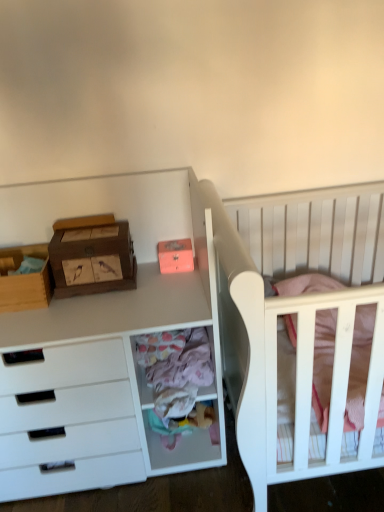
Question: Is wooden storage box at left, arranged as the 1th storage box when viewed from the left, not within white wood crib at right?

Choices:
 (A) yes
 (B) no

Answer: (A)

Question: Considering the relative positions of wooden storage box at left, acting as the 2th storage box starting from the right, and white wood crib at right in the image provided, is wooden storage box at left, acting as the 2th storage box starting from the right, behind white wood crib at right?

Choices:
 (A) no
 (B) yes

Answer: (B)

Question: Can white wood crib at right be found inside wooden storage box at left, arranged as the 1th storage box when viewed from the left?

Choices:
 (A) no
 (B) yes

Answer: (A)

Question: From the image's perspective, does wooden storage box at left, acting as the 2th storage box starting from the right, appear lower than white wood crib at right?

Choices:
 (A) no
 (B) yes

Answer: (A)

Question: Does wooden storage box at left, acting as the 2th storage box starting from the right, have a greater width compared to white wood crib at right?

Choices:
 (A) no
 (B) yes

Answer: (A)

Question: From the image's perspective, relative to wooden with bird designs at left, is white wood crib at right above or below?

Choices:
 (A) below
 (B) above

Answer: (A)

Question: Would you say white wood crib at right is inside or outside wooden with bird designs at left?

Choices:
 (A) inside
 (B) outside

Answer: (B)

Question: From a real-world perspective, is white wood crib at right positioned above or below wooden with bird designs at left?

Choices:
 (A) below
 (B) above

Answer: (A)

Question: Is white wood crib at right bigger or smaller than wooden with bird designs at left?

Choices:
 (A) small
 (B) big

Answer: (B)

Question: From their relative heights in the image, would you say matte orange storage box at upper center, which appears as the second storage box when viewed from the left, is taller or shorter than white wood crib at right?

Choices:
 (A) tall
 (B) short

Answer: (B)

Question: Looking at their shapes, would you say matte orange storage box at upper center, which appears as the second storage box when viewed from the left, is wider or thinner than white wood crib at right?

Choices:
 (A) thin
 (B) wide

Answer: (A)

Question: Relative to white wood crib at right, is matte orange storage box at upper center, which appears as the second storage box when viewed from the left, in front or behind?

Choices:
 (A) behind
 (B) front

Answer: (A)

Question: From the image's perspective, is matte orange storage box at upper center, which appears as the second storage box when viewed from the left, above or below white wood crib at right?

Choices:
 (A) below
 (B) above

Answer: (B)

Question: Looking at the image, does wooden with bird designs at left seem bigger or smaller compared to wooden chest of drawers at left?

Choices:
 (A) small
 (B) big

Answer: (A)

Question: Is point (130, 278) closer or farther from the camera than point (79, 373)?

Choices:
 (A) closer
 (B) farther

Answer: (B)